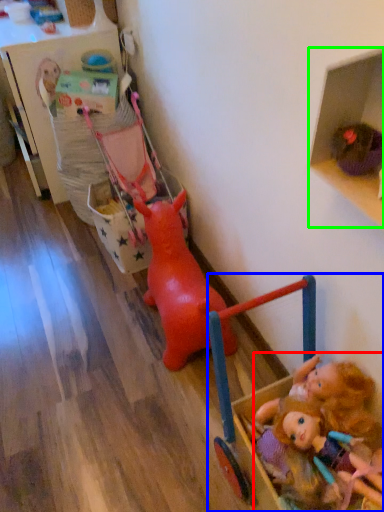
Question: Which is nearer to the person (highlighted by a red box)? toy (highlighted by a blue box) or shelf (highlighted by a green box).

Choices:
 (A) toy
 (B) shelf

Answer: (A)